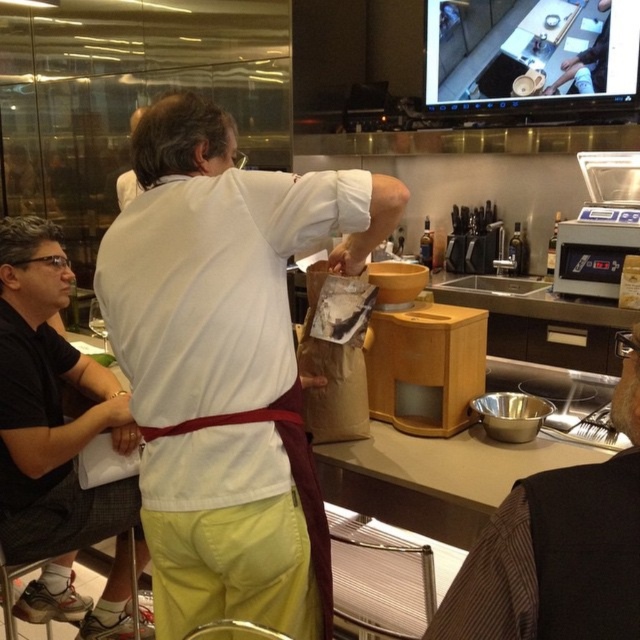
Question: Among these points, which one is farthest from the camera?

Choices:
 (A) (634, 605)
 (B) (220, 115)
 (C) (38, 337)

Answer: (C)

Question: Based on their relative distances, which object is nearer to the brown fabric vest at lower right?

Choices:
 (A) black fabric shirt at left
 (B) white matte shirt at center

Answer: (B)

Question: Is white matte shirt at center wider than black fabric shirt at left?

Choices:
 (A) yes
 (B) no

Answer: (A)

Question: Is white matte shirt at center below black fabric shirt at left?

Choices:
 (A) no
 (B) yes

Answer: (A)

Question: Among these points, which one is nearest to the camera?

Choices:
 (A) (182, 193)
 (B) (625, 358)

Answer: (B)

Question: Can you confirm if white matte shirt at center is bigger than brown fabric vest at lower right?

Choices:
 (A) no
 (B) yes

Answer: (B)